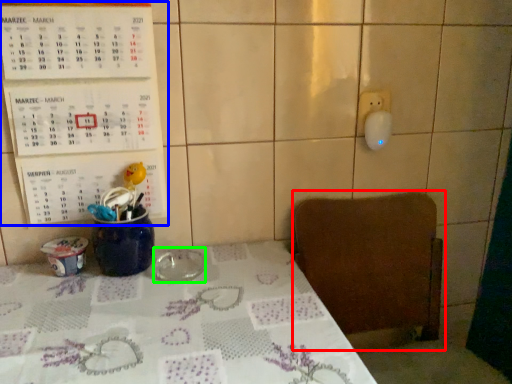
Question: Which object is the farthest from chair (highlighted by a red box)? Choose among these: bulletin board (highlighted by a blue box) or tableware (highlighted by a green box).

Choices:
 (A) bulletin board
 (B) tableware

Answer: (A)